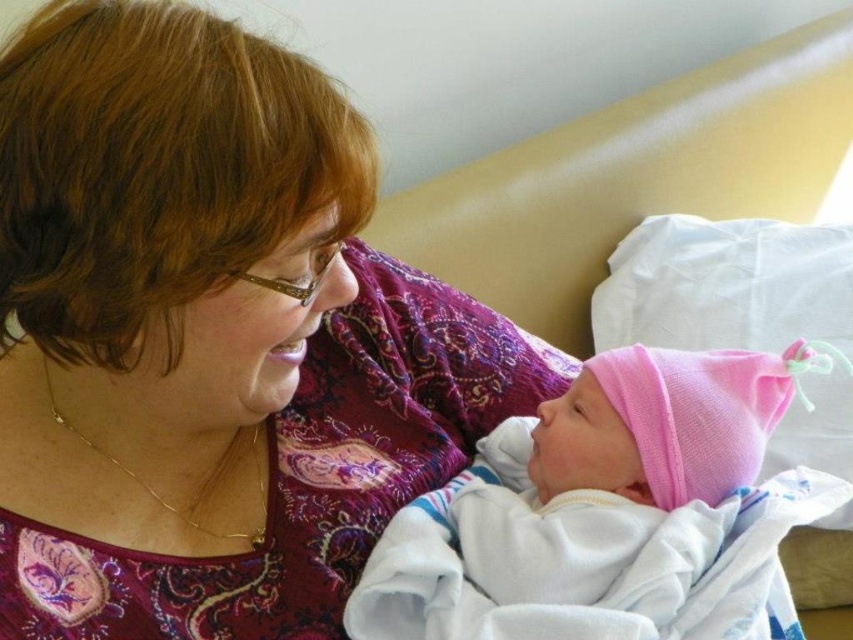
You are a photographer setting up a shot of the scene. You need to ensure that the matte purple blouse at center and the pink fabric hat at center are both in focus. Given their relative sizes, which object should you adjust your camera focus on first to ensure proper depth of field?

The matte purple blouse at center is much taller than the pink fabric hat at center, so you should focus on the taller matte purple blouse at center first to ensure proper depth of field.

You are a photographer taking a portrait of the scene. You want to focus on the matte purple blouse at center. What are the coordinates where you should adjust your camera focus to capture it precisely?

The coordinates to focus on the matte purple blouse at center are point (210, 337).

You are a nurse in a hospital room. You need to place a medical device between the matte purple blouse at center and the pink fabric hat at center. The device requires a minimum of 8 inches of space to function properly. Based on the scene, can the device be placed there?

The distance between the matte purple blouse at center and the pink fabric hat at center is 7.32 inches, which is less than the required 8 inches. Therefore, the device cannot be placed there as it does not meet the space requirement.